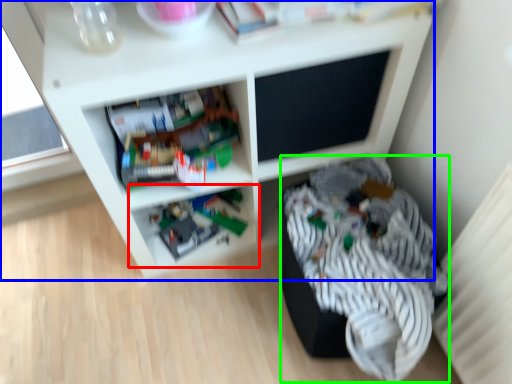
Question: Which object is positioned closest to shelf (highlighted by a red box)? Select from shelf (highlighted by a blue box) and clothing (highlighted by a green box).

Choices:
 (A) shelf
 (B) clothing

Answer: (A)